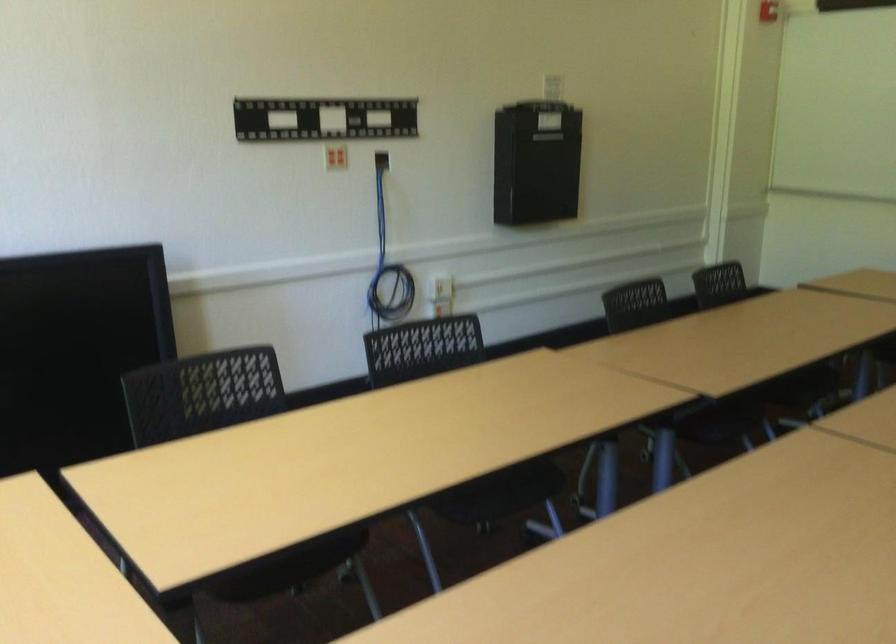
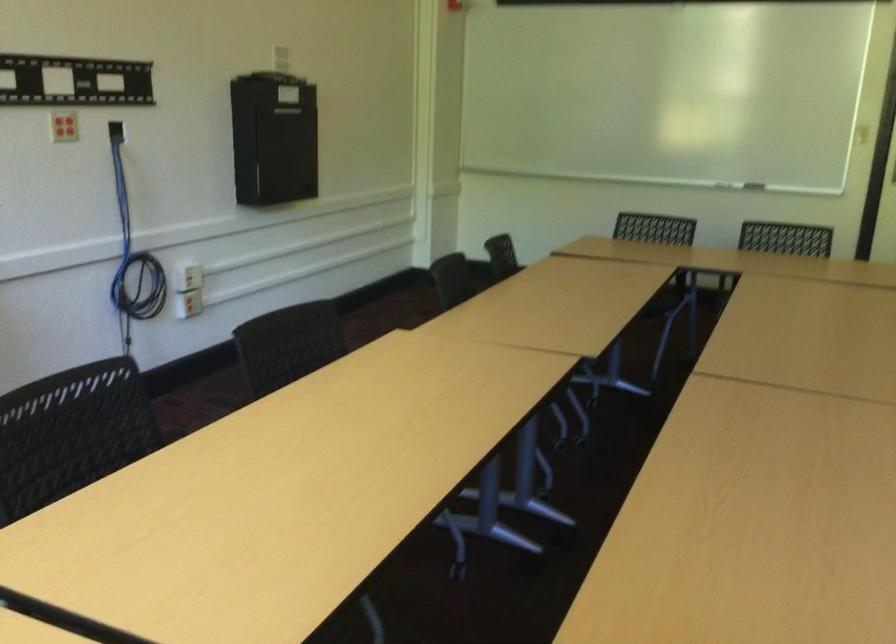
In the second image, find the point that corresponds to point 389,259 in the first image.

(133, 252)